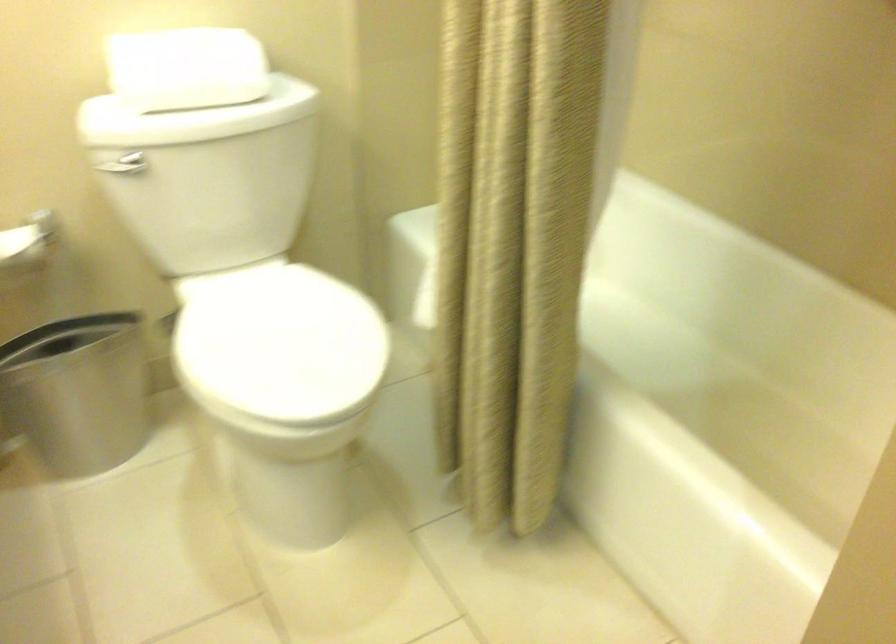
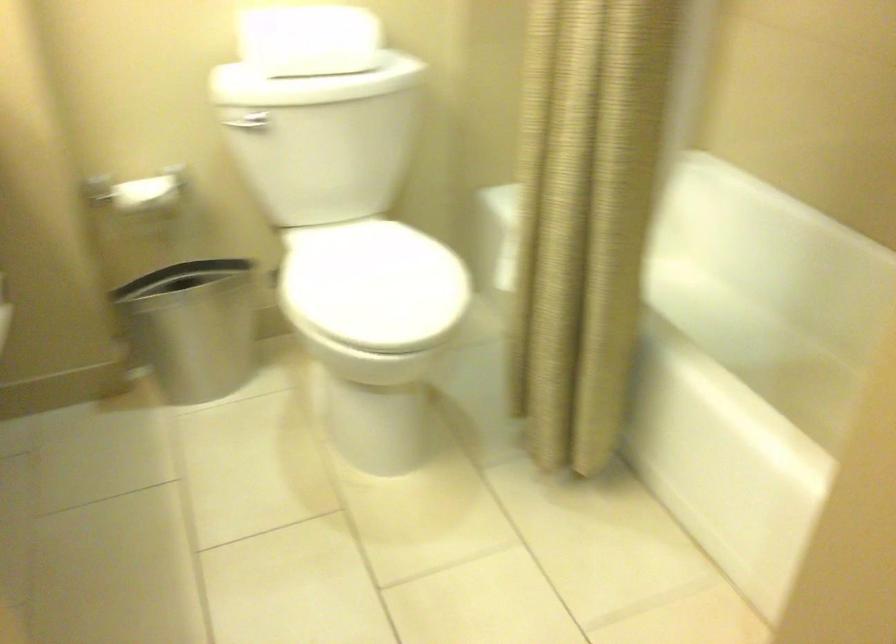
Find the pixel in the second image that matches (x=280, y=344) in the first image.

(372, 285)